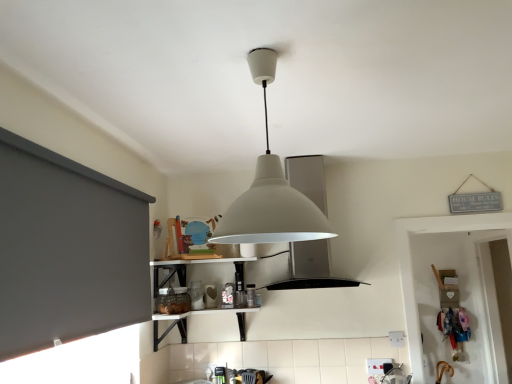
Question: Is white matte lampshade at center to the left of white matte vent at center from the viewer's perspective?

Choices:
 (A) no
 (B) yes

Answer: (B)

Question: Considering the relative sizes of white matte lampshade at center and white matte vent at center in the image provided, is white matte lampshade at center bigger than white matte vent at center?

Choices:
 (A) yes
 (B) no

Answer: (B)

Question: Is white matte lampshade at center oriented towards white matte vent at center?

Choices:
 (A) yes
 (B) no

Answer: (A)

Question: Considering the relative sizes of white matte lampshade at center and white matte vent at center in the image provided, is white matte lampshade at center wider than white matte vent at center?

Choices:
 (A) yes
 (B) no

Answer: (B)

Question: Could white matte vent at center be considered to be inside white matte lampshade at center?

Choices:
 (A) yes
 (B) no

Answer: (B)

Question: Is white matte lampshade at center taller than white matte vent at center?

Choices:
 (A) no
 (B) yes

Answer: (A)

Question: Is white matte vent at center bigger than dark gray matte window screen at left?

Choices:
 (A) yes
 (B) no

Answer: (A)

Question: From the image's perspective, is white matte vent at center on top of dark gray matte window screen at left?

Choices:
 (A) yes
 (B) no

Answer: (A)

Question: Is white matte vent at center directly adjacent to dark gray matte window screen at left?

Choices:
 (A) no
 (B) yes

Answer: (A)

Question: Considering the relative sizes of white matte vent at center and dark gray matte window screen at left in the image provided, is white matte vent at center smaller than dark gray matte window screen at left?

Choices:
 (A) no
 (B) yes

Answer: (A)

Question: Is white matte vent at center to the left of dark gray matte window screen at left from the viewer's perspective?

Choices:
 (A) yes
 (B) no

Answer: (B)

Question: Does white matte vent at center have a lesser width compared to dark gray matte window screen at left?

Choices:
 (A) yes
 (B) no

Answer: (B)

Question: Is white matte lampshade at center bigger than dark gray matte window screen at left?

Choices:
 (A) yes
 (B) no

Answer: (A)